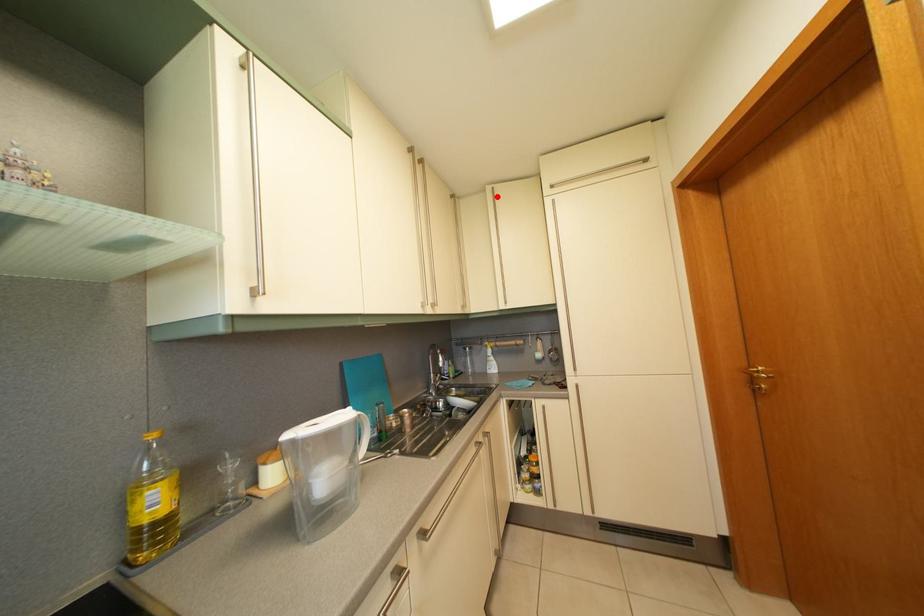
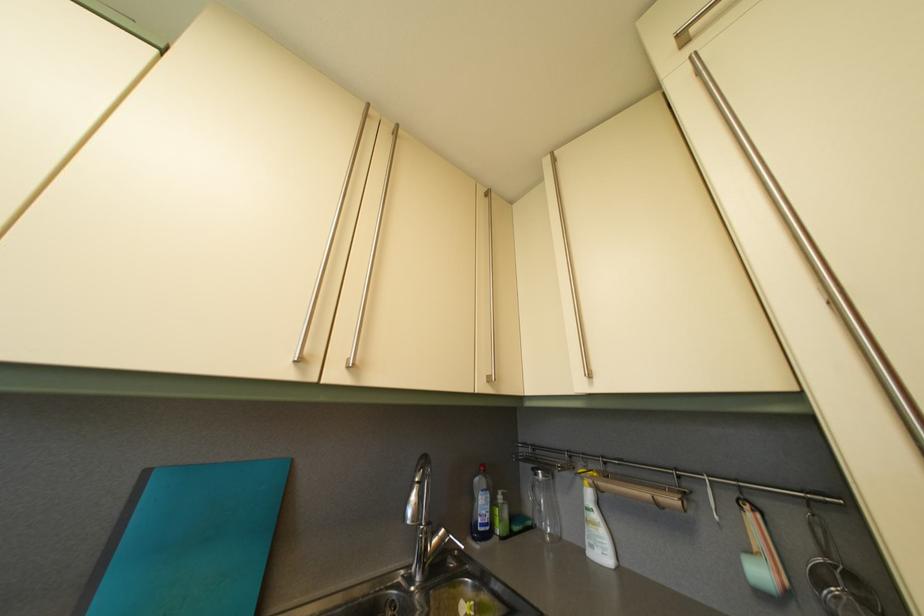
The point at the highlighted location is marked in the first image. Where is the corresponding point in the second image?

(554, 169)